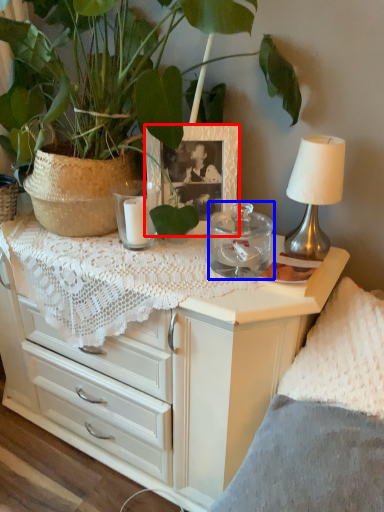
Question: Which object appears closest to the camera in this image, picture frame (highlighted by a red box) or candle holder (highlighted by a blue box)?

Choices:
 (A) picture frame
 (B) candle holder

Answer: (B)